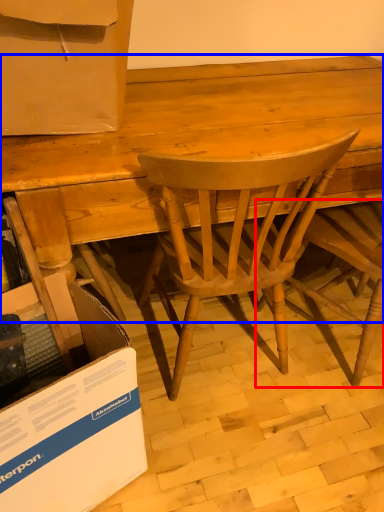
Question: Which point is closer to the camera, chair (highlighted by a red box) or desk (highlighted by a blue box)?

Choices:
 (A) chair
 (B) desk

Answer: (A)